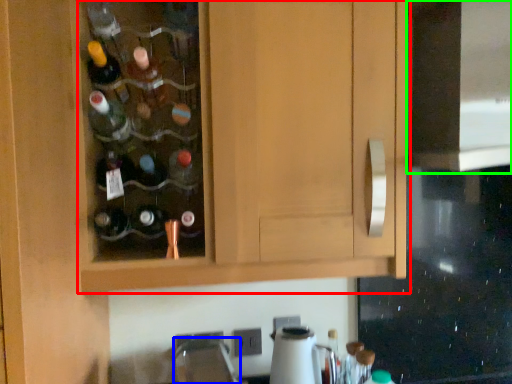
Question: Estimate the real-world distances between objects in this image. Which object is closer to cabinetry (highlighted by a red box), faucet (highlighted by a blue box) or oven (highlighted by a green box)?

Choices:
 (A) faucet
 (B) oven

Answer: (B)